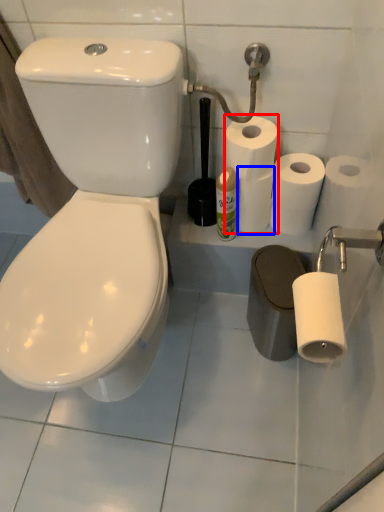
Question: Which point is further to the camera, toilet paper (highlighted by a red box) or paper towel (highlighted by a blue box)?

Choices:
 (A) toilet paper
 (B) paper towel

Answer: (B)